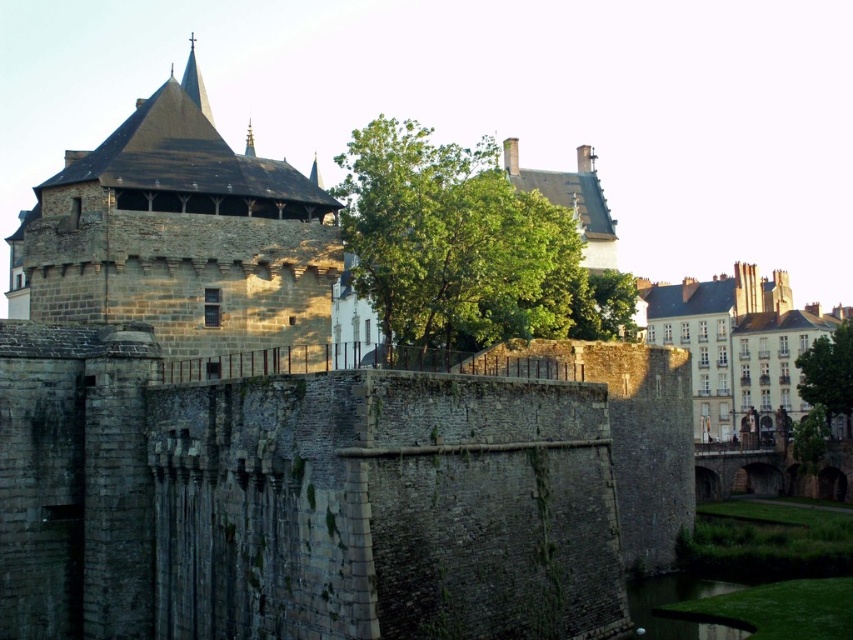
Does green grassy bank at lower right have a larger size compared to green leafy tree at upper center?

Incorrect, green grassy bank at lower right is not larger than green leafy tree at upper center.

Which is in front, point (677, 588) or point (618, 285)?

Point (677, 588)

Which is in front, point (636, 625) or point (625, 284)?

Point (636, 625) is more forward.

Identify the location of green grassy bank at lower right. (676, 602).

Describe the element at coordinates (453, 243) in the screenshot. I see `green leafy tree at center` at that location.

Between green leafy tree at center and green leafy tree at lower right, which one is positioned higher?

green leafy tree at center is higher up.

Is point (457, 148) positioned in front of point (804, 362)?

No, (457, 148) is further to viewer.

You are a GUI agent. You are given a task and a screenshot of the screen. Output one action in this format:
    pyautogui.click(x=<x>, y=<y>)
    Task: Click on the green leafy tree at center
    This screenshot has height=640, width=853.
    Given the screenshot: What is the action you would take?
    pyautogui.click(x=453, y=243)

Can you confirm if green leafy tree at lower right is positioned to the right of green leafy tree at upper center?

Yes, green leafy tree at lower right is to the right of green leafy tree at upper center.

Is point (825, 372) behind point (635, 285)?

Yes, it is behind point (635, 285).

Which is in front, point (848, 317) or point (593, 280)?

Point (593, 280) is more forward.

Find the location of `green leafy tree at lower right`. green leafy tree at lower right is located at coordinates (828, 372).